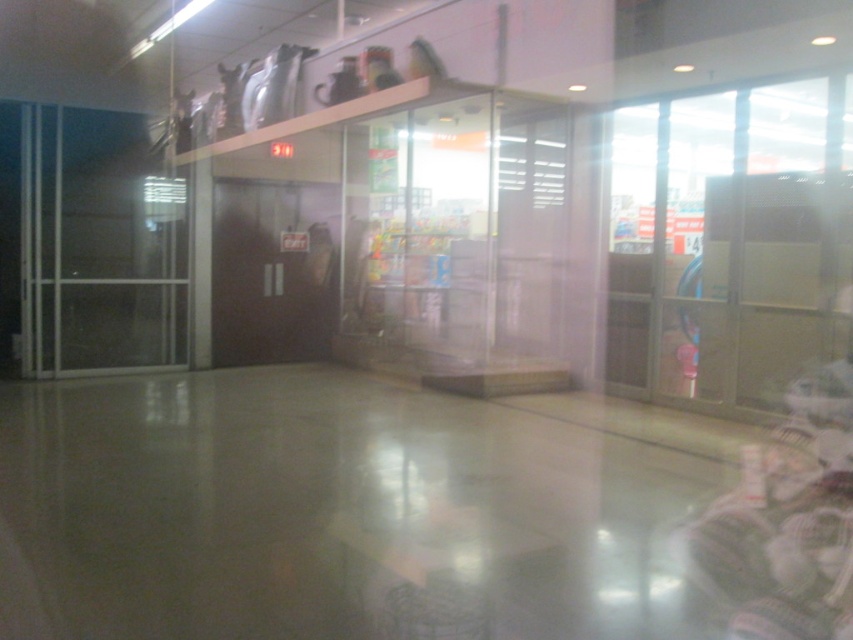
Question: Which point is closer to the camera taking this photo?

Choices:
 (A) (50, 115)
 (B) (691, 221)

Answer: (B)

Question: Does transparent plastic glass door at right have a larger size compared to transparent glass door at left?

Choices:
 (A) yes
 (B) no

Answer: (A)

Question: Which object appears closest to the camera in this image?

Choices:
 (A) transparent plastic glass door at right
 (B) transparent glass door at left

Answer: (A)

Question: Is transparent plastic glass door at right thinner than transparent glass door at left?

Choices:
 (A) no
 (B) yes

Answer: (B)

Question: From the image, what is the correct spatial relationship of transparent plastic glass door at right in relation to transparent glass door at left?

Choices:
 (A) below
 (B) above

Answer: (A)